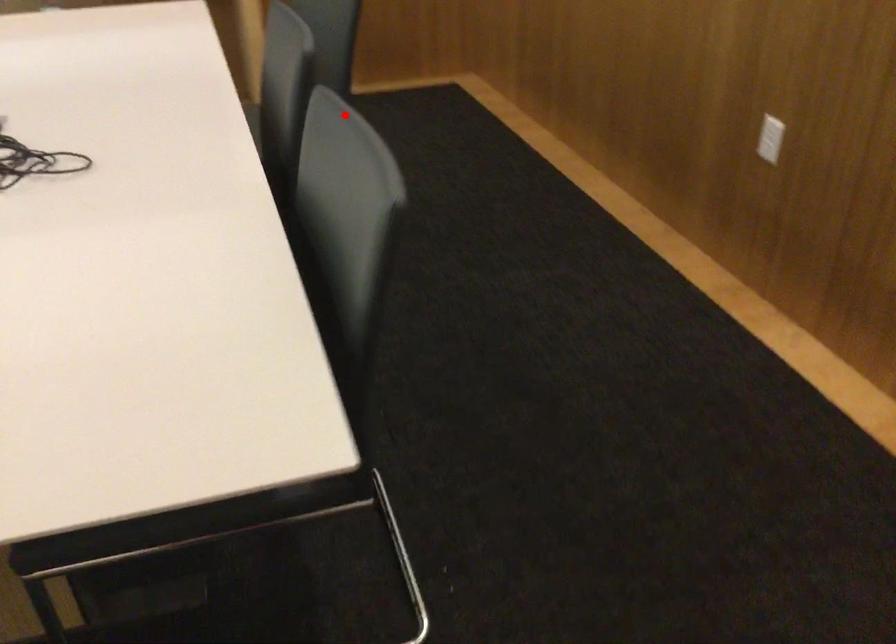
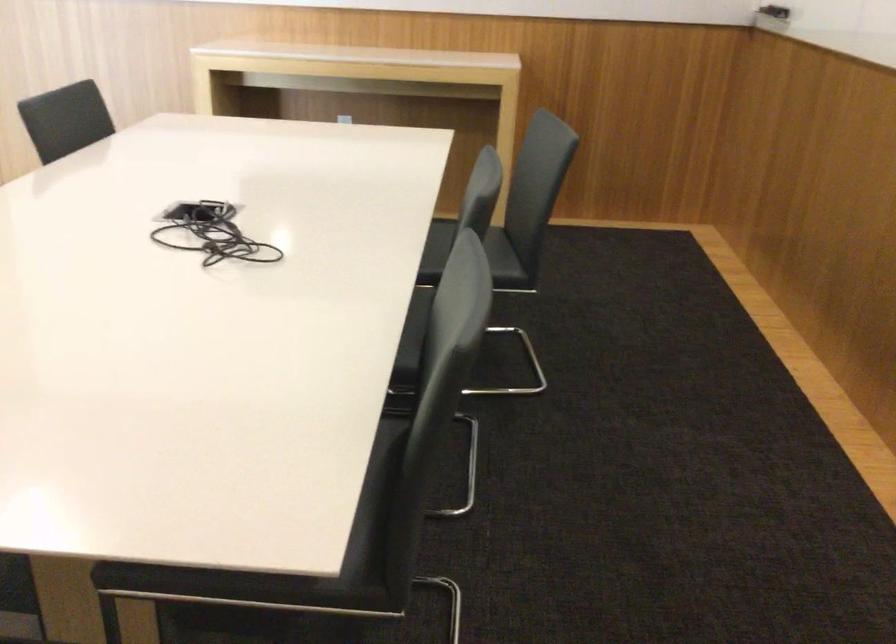
Question: I am providing you with two images of the same scene from different viewpoints. A red point is shown in image1. For the corresponding object point in image2, is it positioned nearer or farther from the camera?

Choices:
 (A) Nearer
 (B) Farther

Answer: (B)